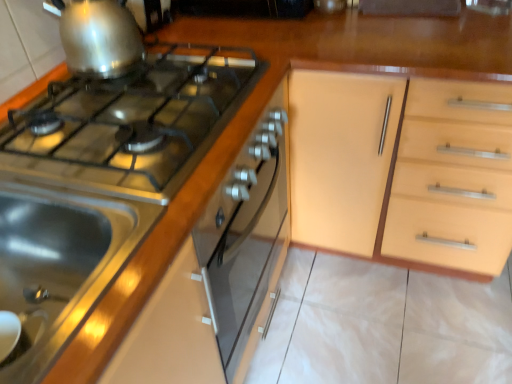
Question: Is point (0, 274) positioned closer to the camera than point (120, 29)?

Choices:
 (A) closer
 (B) farther

Answer: (A)

Question: From the image's perspective, is stainless steel sink at lower left above or below shiny metallic kettle at upper left, arranged as the first kitchen appliance when viewed from the top?

Choices:
 (A) above
 (B) below

Answer: (B)

Question: Considering the real-world distances, which object is farthest from the shiny metallic kettle at upper left, arranged as the first kitchen appliance when viewed from the top?

Choices:
 (A) satin silver gas stove at left
 (B) stainless steel stove at upper left, which is counted as the 1th kitchen appliance, starting from the bottom
 (C) stainless steel sink at lower left

Answer: (C)

Question: Which object is positioned farthest from the shiny metallic kettle at upper left, which is counted as the 2th kitchen appliance, starting from the bottom?

Choices:
 (A) satin silver gas stove at left
 (B) stainless steel sink at lower left
 (C) stainless steel stove at upper left, the second kitchen appliance when ordered from top to bottom

Answer: (B)